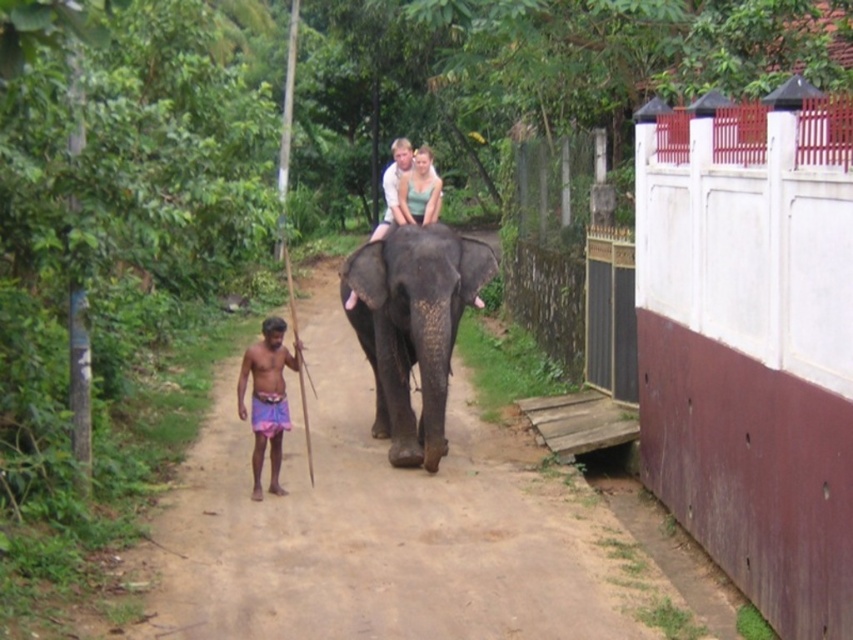
Question: Is brown dirt path at center positioned in front of pink fabric shorts at lower center?

Choices:
 (A) yes
 (B) no

Answer: (A)

Question: In this image, where is dark gray textured elephant at center located relative to pink fabric shorts at lower center?

Choices:
 (A) left
 (B) right

Answer: (B)

Question: Which point is farther to the camera?

Choices:
 (A) pink fabric shorts at lower center
 (B) dark gray textured elephant at center
 (C) brown dirt path at center
 (D) green textured top at center

Answer: (D)

Question: Which object appears farthest from the camera in this image?

Choices:
 (A) green textured top at center
 (B) dark gray textured elephant at center
 (C) brown dirt path at center
 (D) pink fabric shorts at lower center

Answer: (A)

Question: Which object is the closest to the pink fabric shorts at lower center?

Choices:
 (A) green textured top at center
 (B) brown dirt path at center

Answer: (B)

Question: Is brown dirt path at center above dark gray textured elephant at center?

Choices:
 (A) yes
 (B) no

Answer: (A)